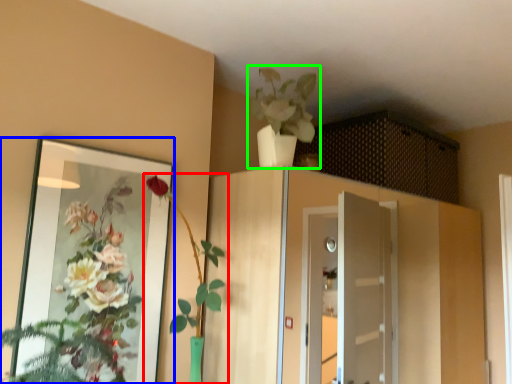
Question: Considering the real-world distances, which object is farthest from houseplant (highlighted by a red box)? mirror (highlighted by a blue box) or houseplant (highlighted by a green box)?

Choices:
 (A) mirror
 (B) houseplant

Answer: (B)